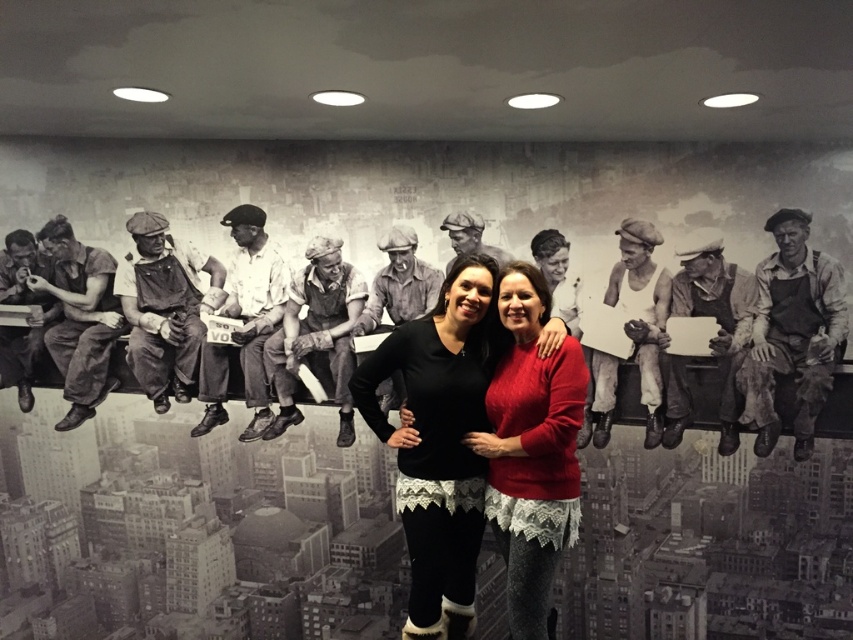
You are an artist trying to recreate the mural. You notice two distinct clothing items in the scene. Which clothing item, the red sweater at center or the black fabric overalls at left, would require more fabric to depict accurately?

The red sweater at center is bigger than the black fabric overalls at left, so it would require more fabric to depict accurately.

You are a fashion designer observing the two women in the scene. You need to determine which clothing item has a wider silhouette between the black lace top at center and the matte black overalls at left. Which one should you choose for a design that emphasizes width?

The black lace top at center has a larger width than the matte black overalls at left, so it would be the better choice for a design emphasizing width.

You are a photographer trying to capture the two points in the image. Which point, point [450,552] or point [12,296], is closer to your camera lens?

Point [450,552] is closer to the camera lens than point [12,296].